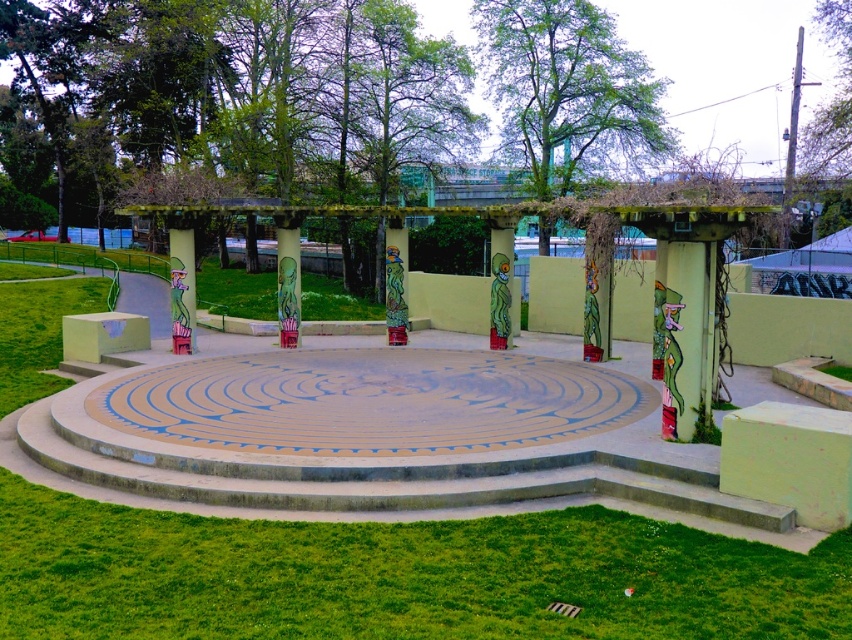
Between green grass at center and green matte column at center-right, which one appears on the left side from the viewer's perspective?

From the viewer's perspective, green grass at center appears more on the left side.

What do you see at coordinates (398, 577) in the screenshot? I see `green grass at center` at bounding box center [398, 577].

Is point (626, 614) positioned behind point (688, 250)?

No, it is in front of (688, 250).

At what (x,y) coordinates should I click in order to perform the action: click on green grass at center. Please return your answer as a coordinate pair (x, y). Looking at the image, I should click on (398, 577).

Does green matte column at center-right have a lesser height compared to matte green pillar at center?

Correct, green matte column at center-right is not as tall as matte green pillar at center.

Describe the element at coordinates (684, 333) in the screenshot. I see `green matte column at center-right` at that location.

Which is in front, point (681, 376) or point (180, 266)?

Point (681, 376)

Where is `green matte column at center-right`? Image resolution: width=852 pixels, height=640 pixels. green matte column at center-right is located at coordinates (684, 333).

Between green grass at center and matte green pillar at center, which one has less height?

green grass at center is shorter.

Between green grass at center and matte green pillar at center, which one is positioned higher?

matte green pillar at center is higher up.

Where is `green grass at center`? The image size is (852, 640). green grass at center is located at coordinates pyautogui.click(x=398, y=577).

Locate an element on the screen. Image resolution: width=852 pixels, height=640 pixels. green grass at center is located at coordinates (398, 577).